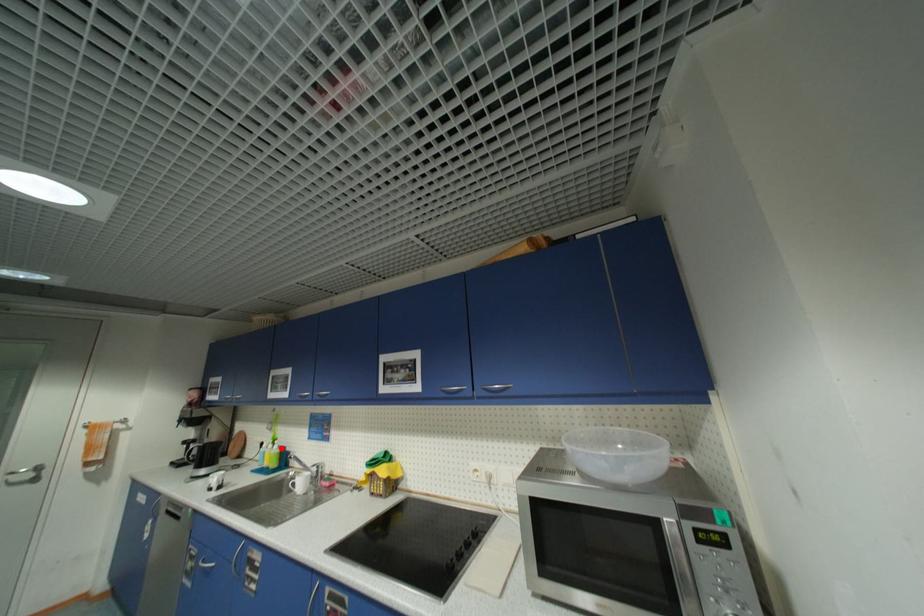
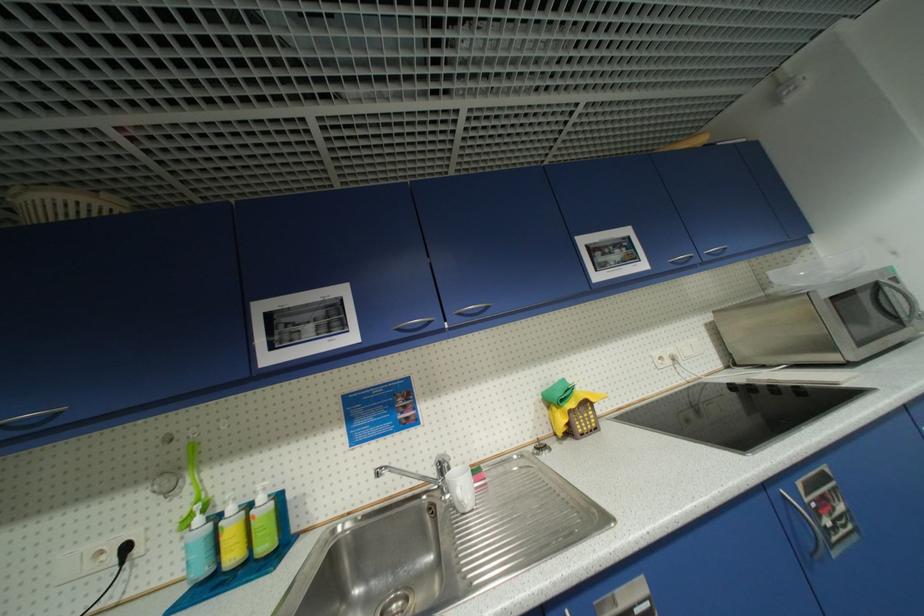
Question: I am providing you with two images of the same scene from different viewpoints. In image1, a red point is highlighted. Considering the same 3D point in image2, which of the following is correct?

Choices:
 (A) It is closer
 (B) It is farther

Answer: (A)